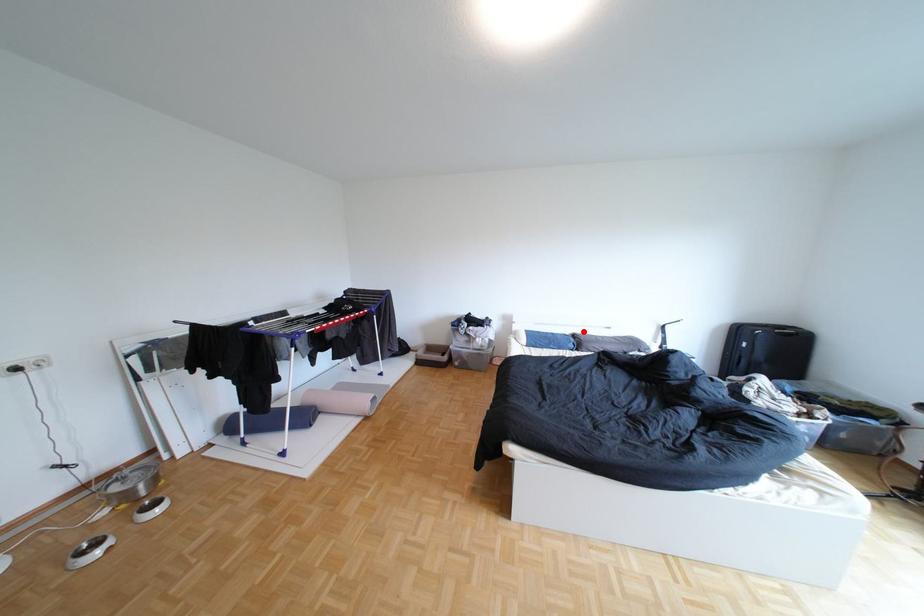
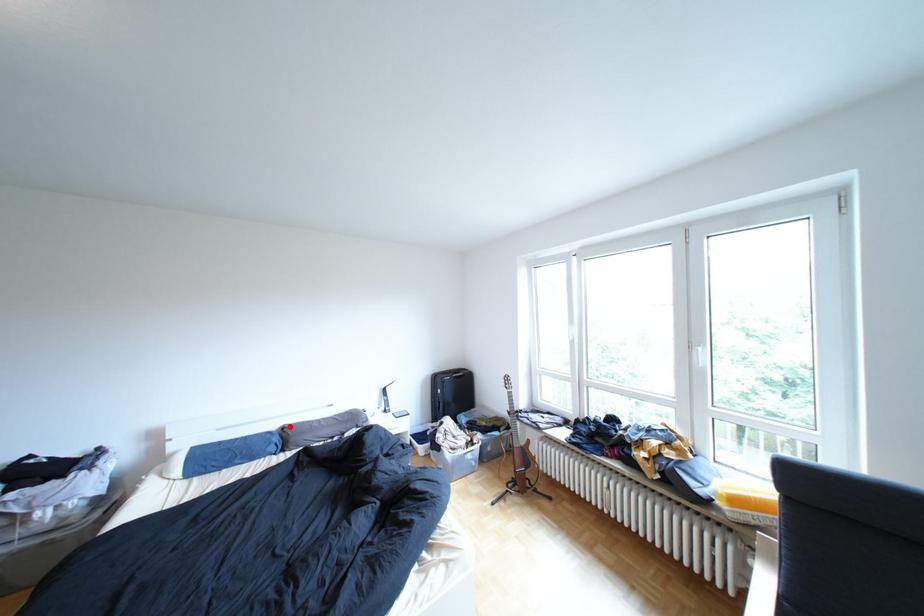
I am providing you with two images of the same scene from different viewpoints. A red point is marked on the first image and another point is marked on the second image. Is the marked point in image1 the same physical position as the marked point in image2?

Yes